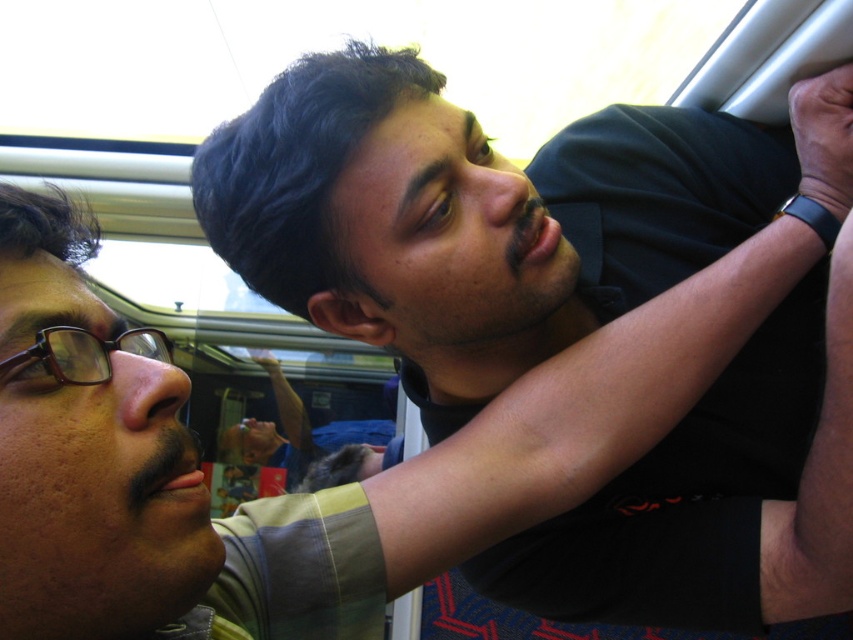
Question: Does black matte shirt at upper center appear on the right side of brown plastic glasses at left?

Choices:
 (A) yes
 (B) no

Answer: (A)

Question: Where is black matte shirt at upper center located in relation to brown plastic glasses at left in the image?

Choices:
 (A) right
 (B) left

Answer: (A)

Question: Among these points, which one is farthest from the camera?

Choices:
 (A) (140, 355)
 (B) (509, 300)

Answer: (B)

Question: Is black matte shirt at upper center positioned behind brown plastic glasses at left?

Choices:
 (A) no
 (B) yes

Answer: (B)